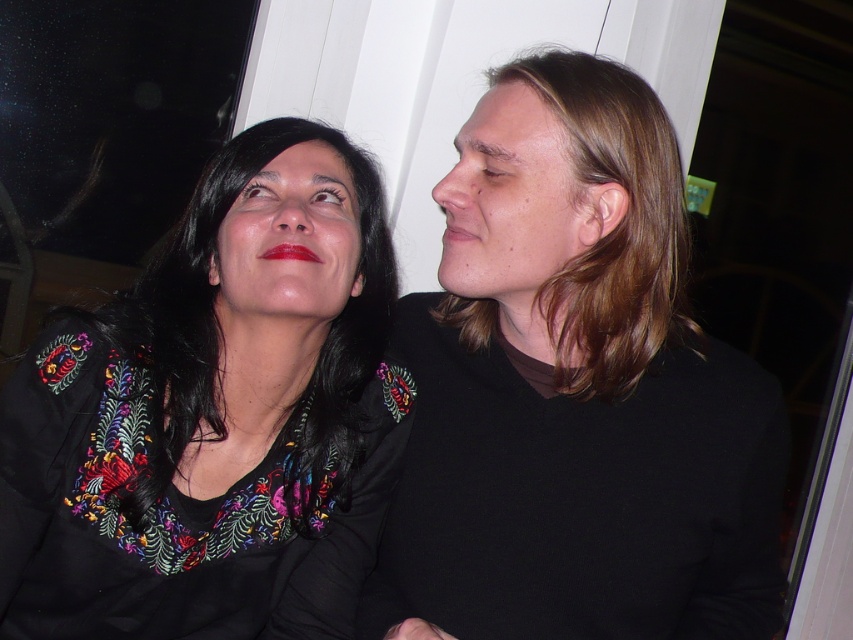
Between embroidered fabric blouse at upper left and blonde hair at upper right, which one appears on the left side from the viewer's perspective?

embroidered fabric blouse at upper left is more to the left.

Between point (27, 580) and point (607, 160), which one is positioned behind?

Positioned behind is point (27, 580).

Identify the location of embroidered fabric blouse at upper left. This screenshot has width=853, height=640. (213, 416).

Can you confirm if black embroidered shirt at upper right is smaller than embroidered fabric blouse at upper left?

No, black embroidered shirt at upper right is not smaller than embroidered fabric blouse at upper left.

In the scene shown: Between black embroidered shirt at upper right and embroidered fabric blouse at upper left, which one has less height?

With less height is embroidered fabric blouse at upper left.

Does point (775, 477) come farther from viewer compared to point (305, 486)?

Yes, it is.

Where is `black embroidered shirt at upper right`? This screenshot has width=853, height=640. black embroidered shirt at upper right is located at coordinates (575, 392).

Does black embroidered shirt at upper right appear on the right side of blonde hair at upper right?

Incorrect, black embroidered shirt at upper right is not on the right side of blonde hair at upper right.

Who is more forward, [698,348] or [606,288]?

Point [606,288] is more forward.

Where is `black embroidered shirt at upper right`? The width and height of the screenshot is (853, 640). black embroidered shirt at upper right is located at coordinates (575, 392).